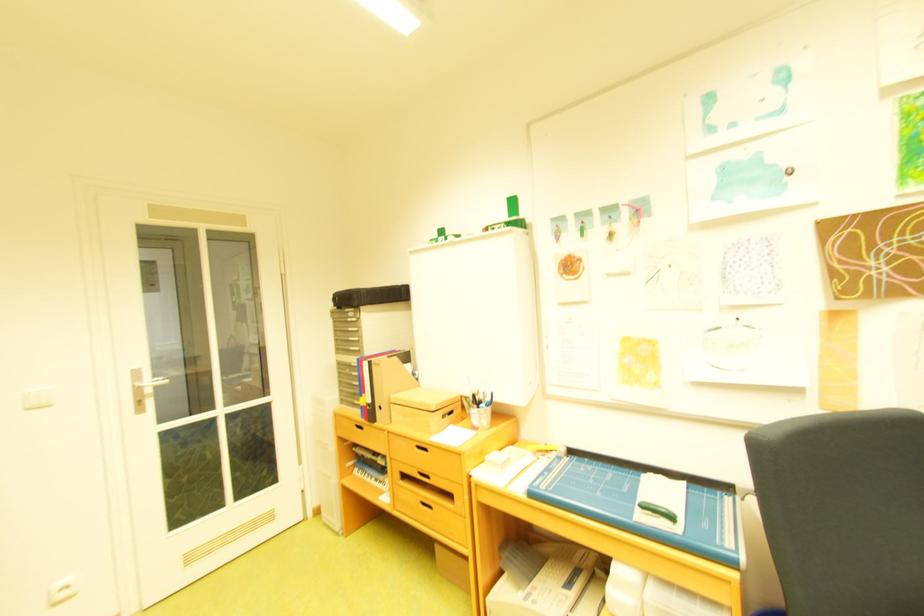
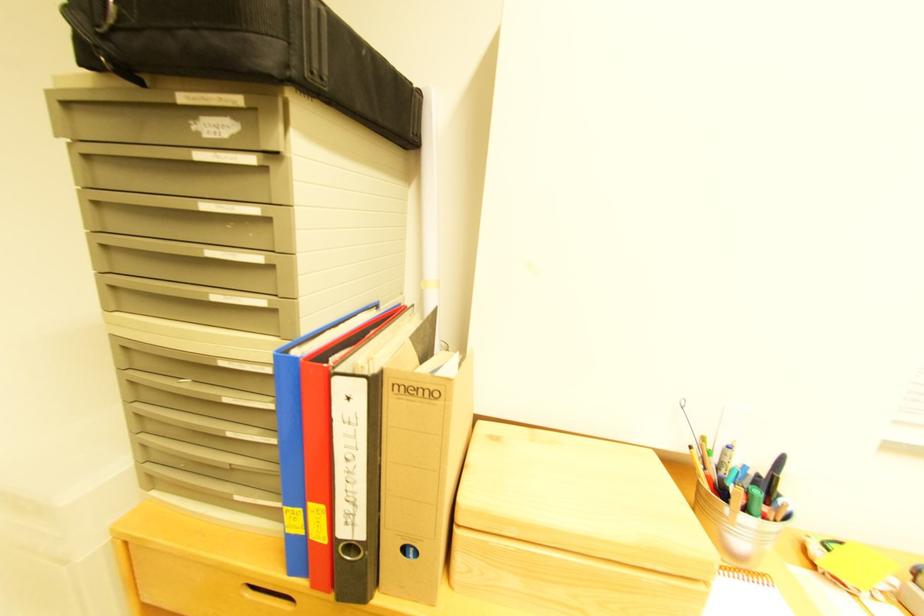
Where in the second image is the point corresponding to the point at 370,342 from the first image?

(282, 268)